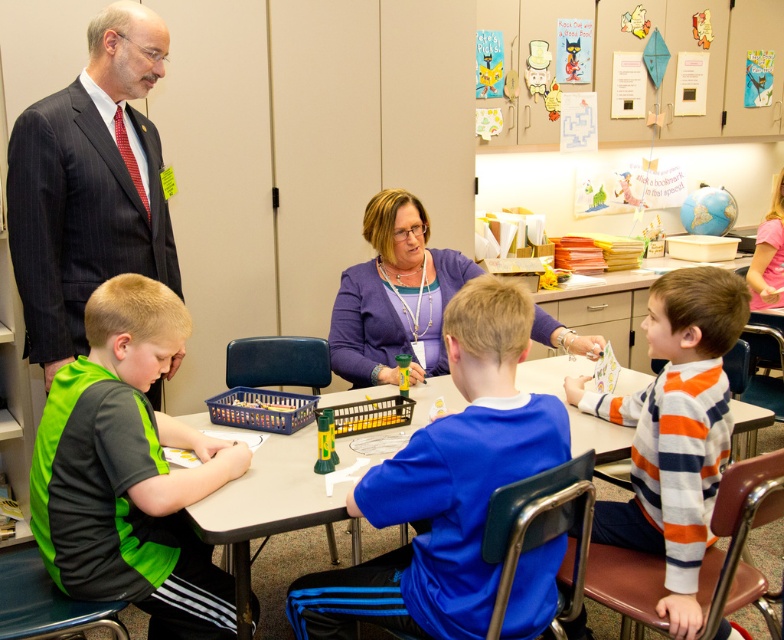
Who is shorter, green jersey at lower left or smooth plastic table at center?

Standing shorter between the two is smooth plastic table at center.

Is green jersey at lower left bigger than smooth plastic table at center?

No.

The width and height of the screenshot is (784, 640). What do you see at coordinates (129, 472) in the screenshot?
I see `green jersey at lower left` at bounding box center [129, 472].

Identify the location of green jersey at lower left. (129, 472).

Is purple cardigan at upper center shorter than purple fabric sweater at center?

Incorrect, purple cardigan at upper center's height does not fall short of purple fabric sweater at center's.

Between point (48, 376) and point (372, 209), which one is positioned in front?

Point (48, 376)

Find the location of `purple cardigan at upper center`. purple cardigan at upper center is located at coordinates (89, 186).

Find the location of a particular element. purple cardigan at upper center is located at coordinates (89, 186).

Which of these two, purple cardigan at upper center or orange striped sweater at right, stands taller?

With more height is purple cardigan at upper center.

Does point (51, 355) come in front of point (701, 460)?

No, it is not.

Locate an element on the screen. The width and height of the screenshot is (784, 640). purple cardigan at upper center is located at coordinates (89, 186).